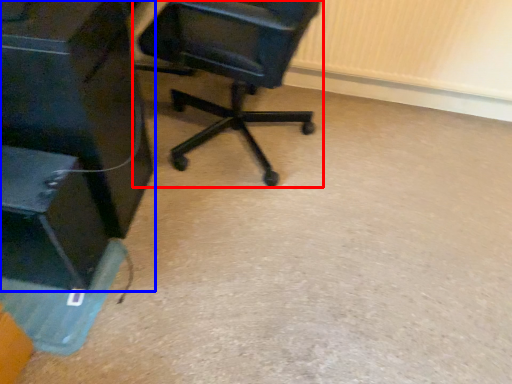
Question: Which object is further to the camera taking this photo, chair (highlighted by a red box) or furniture (highlighted by a blue box)?

Choices:
 (A) chair
 (B) furniture

Answer: (A)